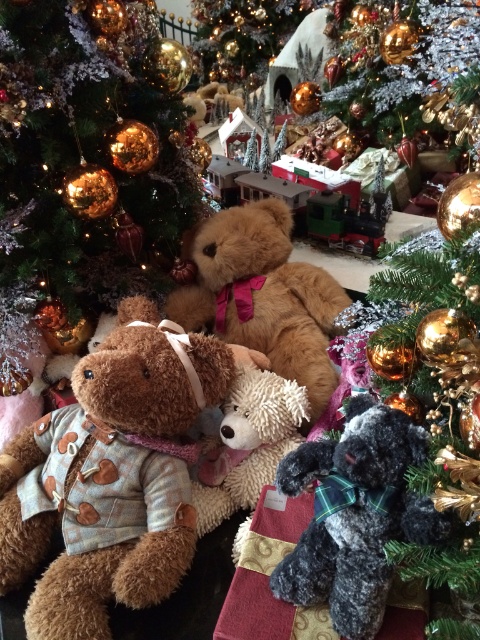
Can you confirm if dark gray plush bear at lower right is positioned below fluffy beige teddy bear at center?

Correct, dark gray plush bear at lower right is located below fluffy beige teddy bear at center.

Does dark gray plush bear at lower right appear on the right side of fluffy beige teddy bear at center?

Yes, dark gray plush bear at lower right is to the right of fluffy beige teddy bear at center.

The width and height of the screenshot is (480, 640). Describe the element at coordinates (356, 515) in the screenshot. I see `dark gray plush bear at lower right` at that location.

Locate an element on the screen. This screenshot has height=640, width=480. dark gray plush bear at lower right is located at coordinates (356, 515).

Based on the photo, who is lower down, dark gray plush bear at lower right or shiny gold ornaments at upper center?

dark gray plush bear at lower right is lower down.

Who is higher up, dark gray plush bear at lower right or shiny gold ornaments at upper center?

shiny gold ornaments at upper center

Where is `dark gray plush bear at lower right`? This screenshot has width=480, height=640. dark gray plush bear at lower right is located at coordinates (356, 515).

From the picture: Between shiny gold ornaments at upper center and fluffy beige teddy bear at center, which one appears on the right side from the viewer's perspective?

Positioned to the right is shiny gold ornaments at upper center.

Is point (381, 138) positioned behind point (276, 448)?

That is True.

Locate an element on the screen. This screenshot has width=480, height=640. shiny gold ornaments at upper center is located at coordinates (407, 70).

Find the location of `shiny gold ornaments at upper center`. shiny gold ornaments at upper center is located at coordinates (407, 70).